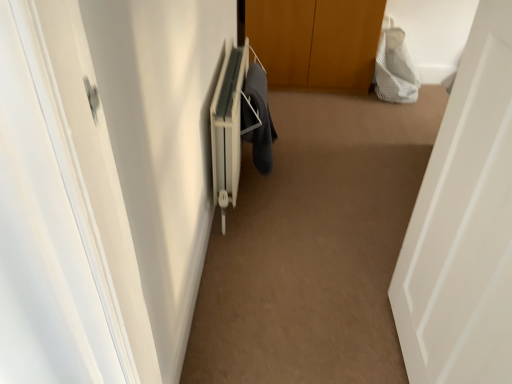
Question: Can you confirm if white matte door at right is thinner than dark gray fabric at center?

Choices:
 (A) no
 (B) yes

Answer: (A)

Question: Is white matte door at right far from dark gray fabric at center?

Choices:
 (A) yes
 (B) no

Answer: (A)

Question: Is white matte door at right turned away from dark gray fabric at center?

Choices:
 (A) no
 (B) yes

Answer: (A)

Question: Is white matte door at right positioned in front of dark gray fabric at center?

Choices:
 (A) no
 (B) yes

Answer: (B)

Question: Does white matte door at right have a smaller size compared to dark gray fabric at center?

Choices:
 (A) yes
 (B) no

Answer: (B)

Question: In terms of height, does dark gray fabric at center look taller or shorter compared to white striped fabric at upper right?

Choices:
 (A) tall
 (B) short

Answer: (B)

Question: In the image, is dark gray fabric at center on the left side or the right side of white striped fabric at upper right?

Choices:
 (A) left
 (B) right

Answer: (A)

Question: Is dark gray fabric at center bigger or smaller than white striped fabric at upper right?

Choices:
 (A) big
 (B) small

Answer: (B)

Question: From a real-world perspective, is dark gray fabric at center physically located above or below white striped fabric at upper right?

Choices:
 (A) above
 (B) below

Answer: (A)

Question: Considering the positions of white matte door at right and white striped fabric at upper right in the image, is white matte door at right wider or thinner than white striped fabric at upper right?

Choices:
 (A) thin
 (B) wide

Answer: (B)

Question: From the image's perspective, relative to white striped fabric at upper right, is white matte door at right above or below?

Choices:
 (A) above
 (B) below

Answer: (B)

Question: Choose the correct answer: Is white matte door at right inside white striped fabric at upper right or outside it?

Choices:
 (A) inside
 (B) outside

Answer: (B)

Question: Considering the positions of white matte door at right and white striped fabric at upper right in the image, is white matte door at right taller or shorter than white striped fabric at upper right?

Choices:
 (A) tall
 (B) short

Answer: (A)

Question: Relative to white matte door at right, is dark gray fabric at center in front or behind?

Choices:
 (A) behind
 (B) front

Answer: (A)

Question: Is point (253, 155) positioned closer to the camera than point (404, 288)?

Choices:
 (A) farther
 (B) closer

Answer: (A)